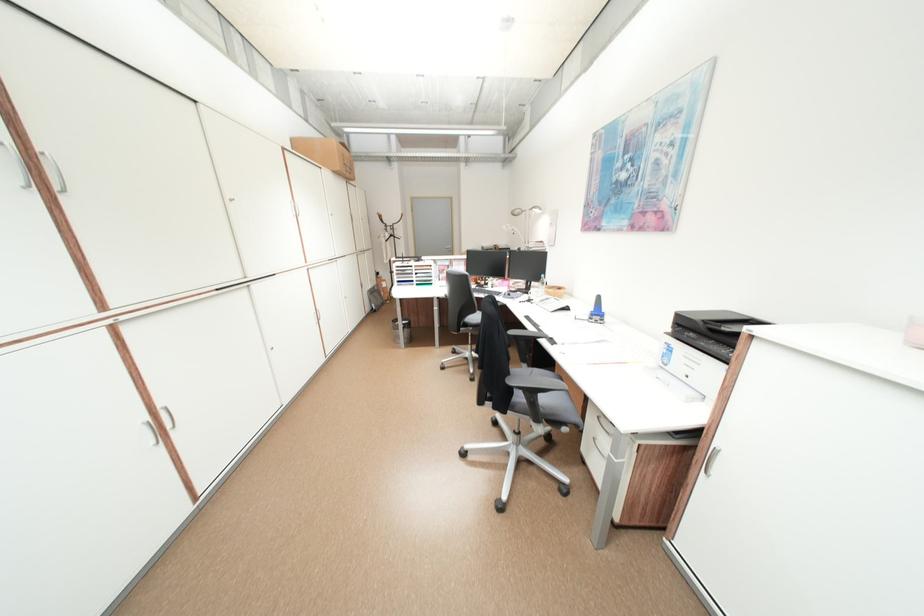
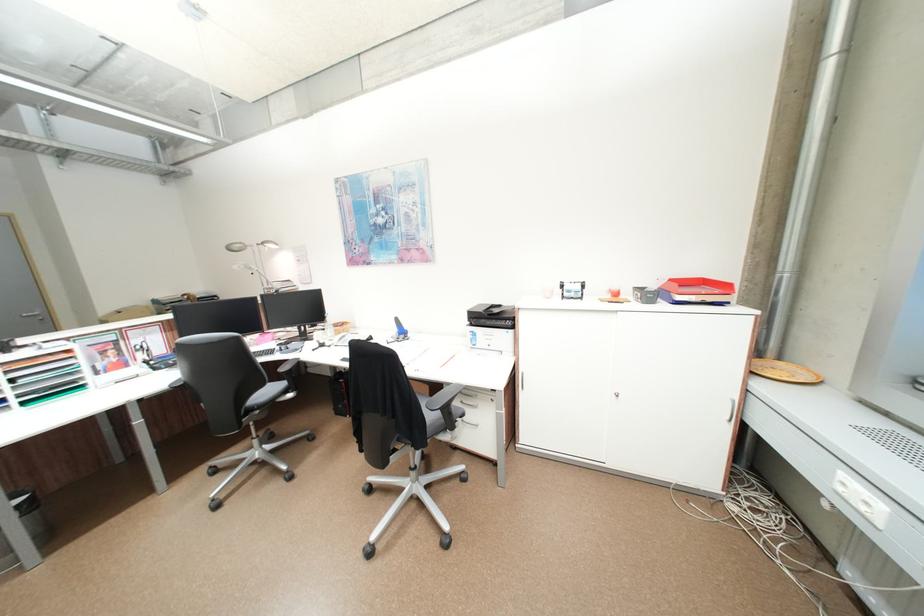
In the second image, find the point that corresponds to (414,323) in the first image.

(27, 509)